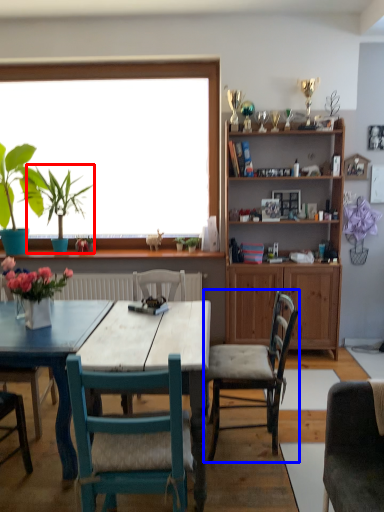
Question: Which object appears closest to the camera in this image, plant (highlighted by a red box) or chair (highlighted by a blue box)?

Choices:
 (A) plant
 (B) chair

Answer: (B)